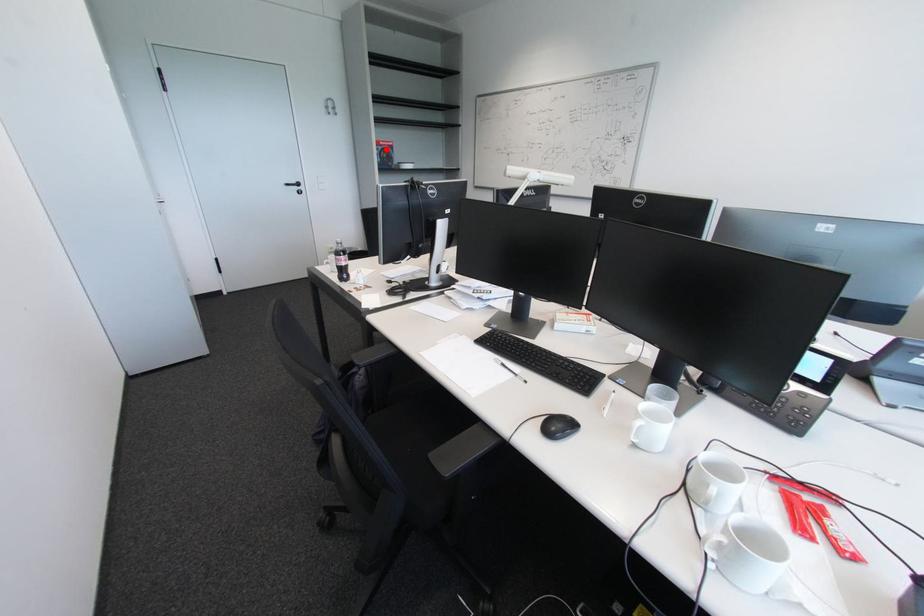
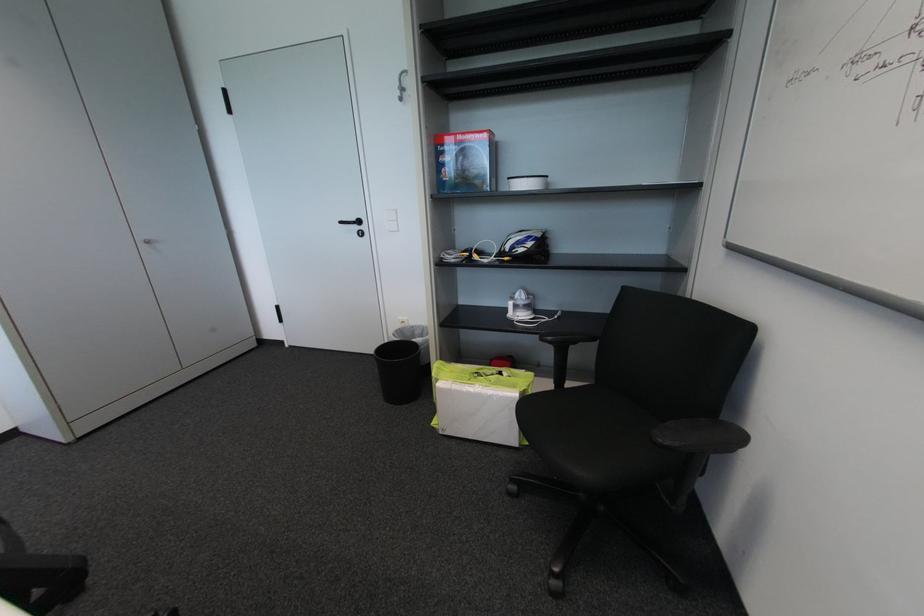
In the second image, find the point that corresponds to the highlighted location in the first image.

(460, 148)